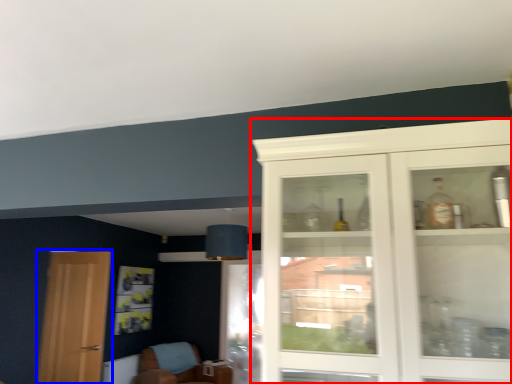
Question: Which object is further to the camera taking this photo, cabinetry (highlighted by a red box) or door (highlighted by a blue box)?

Choices:
 (A) cabinetry
 (B) door

Answer: (B)